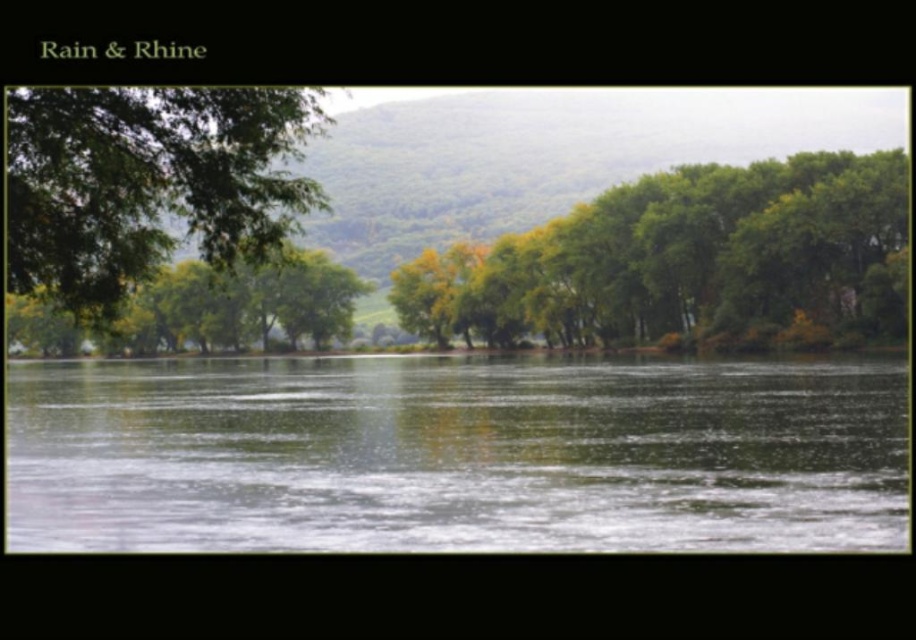
Question: Can you confirm if green reflective water at center is positioned above green leafy tree at left?

Choices:
 (A) yes
 (B) no

Answer: (B)

Question: Is green leafy trees at center thinner than green leafy tree at left?

Choices:
 (A) no
 (B) yes

Answer: (A)

Question: Which point appears closest to the camera in this image?

Choices:
 (A) (229, 392)
 (B) (22, 128)

Answer: (B)

Question: Is green leafy trees at center closer to the viewer compared to green leafy tree at left?

Choices:
 (A) no
 (B) yes

Answer: (A)

Question: Which point is closer to the camera?

Choices:
 (A) (13, 195)
 (B) (887, 172)
 (C) (733, 468)

Answer: (A)

Question: Which object is the farthest from the green leafy trees at center?

Choices:
 (A) green reflective water at center
 (B) green leafy tree at left

Answer: (B)